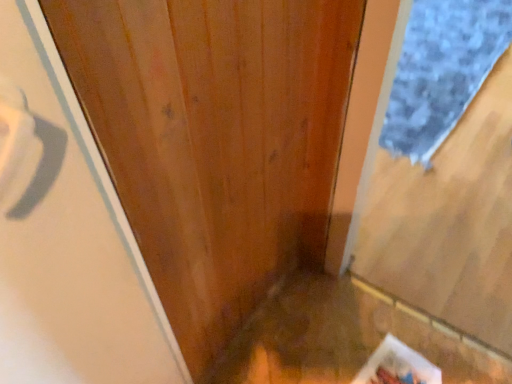
Question: Is white glossy screen door at left wider or thinner than blue textured mat at right?

Choices:
 (A) thin
 (B) wide

Answer: (A)

Question: Looking at the image, does white glossy screen door at left seem bigger or smaller compared to blue textured mat at right?

Choices:
 (A) big
 (B) small

Answer: (B)

Question: Is white glossy screen door at left inside the boundaries of blue textured mat at right, or outside?

Choices:
 (A) inside
 (B) outside

Answer: (B)

Question: Considering their positions, is blue textured mat at right located in front of or behind white glossy screen door at left?

Choices:
 (A) behind
 (B) front

Answer: (A)

Question: In terms of width, does blue textured mat at right look wider or thinner when compared to white glossy screen door at left?

Choices:
 (A) wide
 (B) thin

Answer: (A)

Question: Is blue textured mat at right inside the boundaries of white glossy screen door at left, or outside?

Choices:
 (A) outside
 (B) inside

Answer: (A)

Question: Is blue textured mat at right to the left or to the right of white glossy screen door at left in the image?

Choices:
 (A) left
 (B) right

Answer: (B)